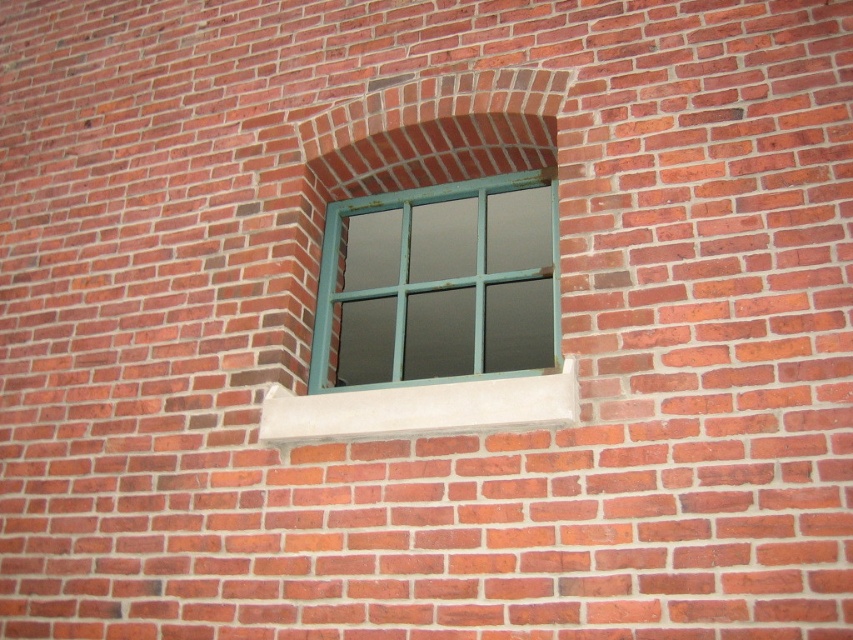
Question: Among these points, which one is farthest from the camera?

Choices:
 (A) (444, 320)
 (B) (358, 406)

Answer: (A)

Question: Among these objects, which one is nearest to the camera?

Choices:
 (A) white concrete at center
 (B) teal painted wood window frame at center
 (C) green painted wood window at center

Answer: (A)

Question: In this image, where is teal painted wood window frame at center located relative to white concrete at center?

Choices:
 (A) left
 (B) right

Answer: (B)

Question: Can you confirm if teal painted wood window frame at center is bigger than white concrete at center?

Choices:
 (A) yes
 (B) no

Answer: (B)

Question: Observing the image, what is the correct spatial positioning of teal painted wood window frame at center in reference to white concrete at center?

Choices:
 (A) right
 (B) left

Answer: (A)

Question: Which of the following is the farthest from the observer?

Choices:
 (A) green painted wood window at center
 (B) teal painted wood window frame at center

Answer: (B)